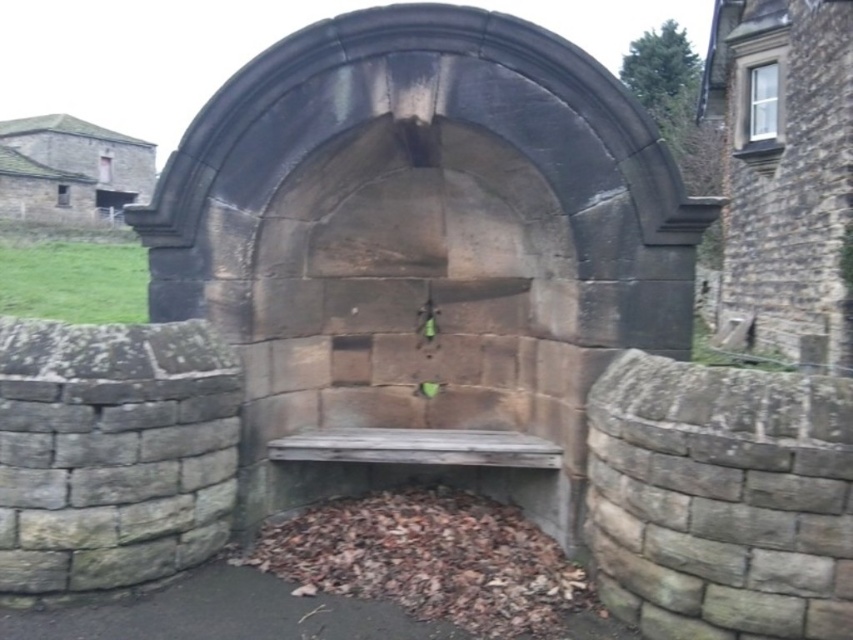
You are standing in front of the old stone structure and want to determine the relative positions of two points marked on it. Which point is nearer to you, the point at coordinates (200, 154) or the point at (399, 458)?

The point at coordinates (200, 154) is closer to you than the point at (399, 458).

You are a maintenance worker needing to place a 1.2 meter long wooden plank between the stone archway at center and the weathered wood bench at center. Can the plank fit horizontally between them?

The distance between the stone archway at center and the weathered wood bench at center is 77.90 centimeters. Since the plank is 1.2 meters long, which is longer than the available space, the plank cannot fit horizontally between them.